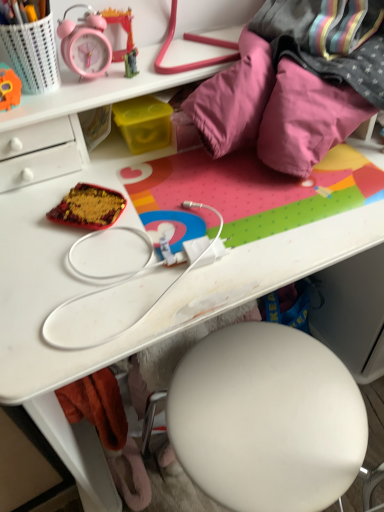
Question: Is orange plush toy at upper left completely or partially inside matte plastic alarm clock at upper left, the 2th stationery from the left?

Choices:
 (A) no
 (B) yes

Answer: (A)

Question: Can you confirm if matte plastic alarm clock at upper left, placed as the second stationery when sorted from right to left, is wider than orange plush toy at upper left?

Choices:
 (A) yes
 (B) no

Answer: (A)

Question: Is matte plastic alarm clock at upper left, the 2th stationery from the left, taller than orange plush toy at upper left?

Choices:
 (A) yes
 (B) no

Answer: (A)

Question: Is matte plastic alarm clock at upper left, placed as the second stationery when sorted from right to left, located outside orange plush toy at upper left?

Choices:
 (A) yes
 (B) no

Answer: (A)

Question: Considering the relative positions of matte plastic alarm clock at upper left, placed as the second stationery when sorted from right to left, and orange plush toy at upper left in the image provided, is matte plastic alarm clock at upper left, placed as the second stationery when sorted from right to left, to the right of orange plush toy at upper left from the viewer's perspective?

Choices:
 (A) no
 (B) yes

Answer: (B)

Question: Relative to shiny red fabric at center, is yellow plastic container at center, the 1th stationery viewed from the right, in front or behind?

Choices:
 (A) front
 (B) behind

Answer: (B)

Question: Considering the positions of yellow plastic container at center, which is the 3th stationery in left-to-right order, and shiny red fabric at center in the image, is yellow plastic container at center, which is the 3th stationery in left-to-right order, wider or thinner than shiny red fabric at center?

Choices:
 (A) wide
 (B) thin

Answer: (B)

Question: Considering the positions of point (150, 109) and point (96, 208), is point (150, 109) closer or farther from the camera than point (96, 208)?

Choices:
 (A) farther
 (B) closer

Answer: (A)

Question: From a real-world perspective, is yellow plastic container at center, the 1th stationery viewed from the right, above or below shiny red fabric at center?

Choices:
 (A) below
 (B) above

Answer: (B)

Question: Does point (9, 96) appear closer or farther from the camera than point (16, 48)?

Choices:
 (A) closer
 (B) farther

Answer: (B)

Question: From a real-world perspective, is orange plush toy at upper left positioned above or below matte plastic pencil case at upper left, the 1th stationery in the left-to-right sequence?

Choices:
 (A) above
 (B) below

Answer: (B)

Question: Is orange plush toy at upper left inside or outside of matte plastic pencil case at upper left, the third stationery from the right?

Choices:
 (A) inside
 (B) outside

Answer: (B)

Question: In the image, is orange plush toy at upper left positioned in front of or behind matte plastic pencil case at upper left, the third stationery from the right?

Choices:
 (A) behind
 (B) front

Answer: (A)

Question: In terms of height, does orange plush toy at upper left look taller or shorter compared to shiny red fabric at center?

Choices:
 (A) short
 (B) tall

Answer: (B)

Question: Would you say orange plush toy at upper left is inside or outside shiny red fabric at center?

Choices:
 (A) inside
 (B) outside

Answer: (B)